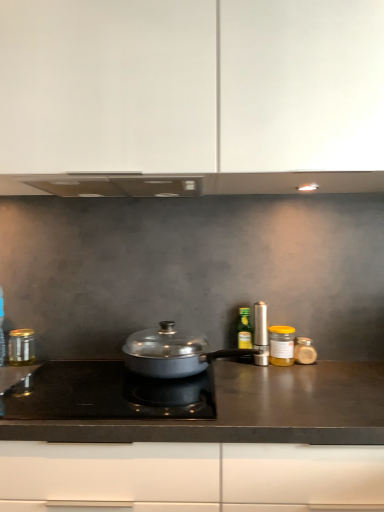
Where is `vacant area that lies between matte silver pan at center, which appears as the second kitchen appliance when viewed from the left, and clear glass jar at left, which appears as the sixth kitchen appliance when viewed from the right`? This screenshot has height=512, width=384. vacant area that lies between matte silver pan at center, which appears as the second kitchen appliance when viewed from the left, and clear glass jar at left, which appears as the sixth kitchen appliance when viewed from the right is located at coordinates click(x=74, y=368).